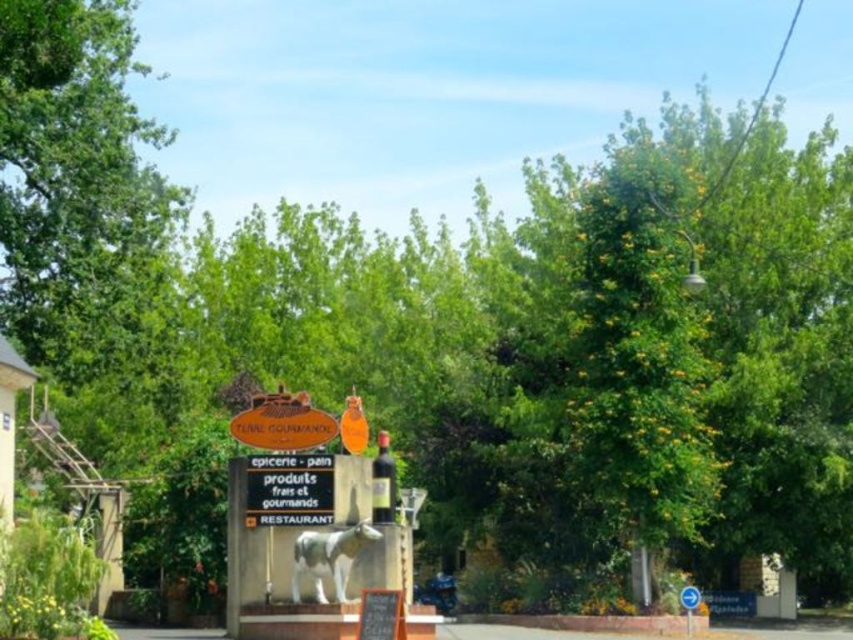
From the picture: You are standing at the entrance of the TUNNEL GOURMAND and want to walk towards the point marked as point (692,604). On your way, you notice another point labeled point (288,420). Which point will you encounter first?

You will encounter point (288,420) first because it is in front of point (692,604) along your path.

Based on the scene description, which object would cast a larger shadow? Please choose between the orange wood sign at center and the white plastic sign at lower right.

The orange wood sign at center is bigger than the white plastic sign at lower right, so it would cast a larger shadow.